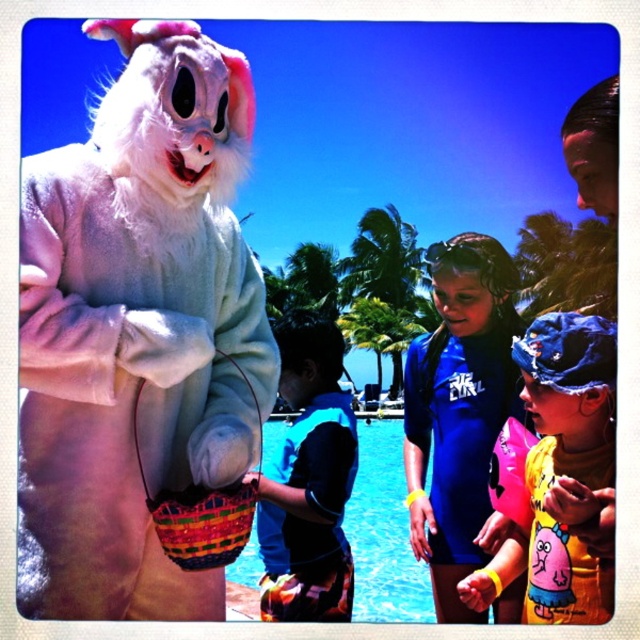
You are standing at the poolside and want to walk to the point marked as point (584, 621). However, there is an obstacle at point (147, 492). Will you be able to see the destination point without any obstruction?

Since point (584, 621) is behind point (147, 492), you will not be able to see the destination point as it is obstructed by the obstacle at point (147, 492).

You are at the poolside and want to pick up the bright multicolored woven basket at lower left. Which object, the fluffy white bunny at upper left or the basket, is closer to you?

The fluffy white bunny at upper left is closer to the viewer than the bright multicolored woven basket at lower left, so the bunny is closer to you.